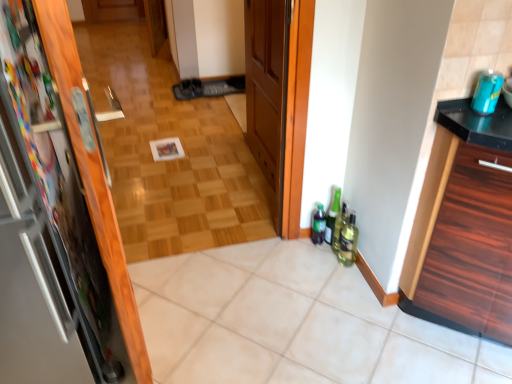
What do you see at coordinates (267, 90) in the screenshot? This screenshot has height=384, width=512. I see `wooden door at center, which is the first door from back to front` at bounding box center [267, 90].

Measure the distance between point (317, 205) and camera.

Point (317, 205) is 6.75 feet away from camera.

What do you see at coordinates (71, 178) in the screenshot? I see `metallic refrigerator at left, the 2th door viewed from the back` at bounding box center [71, 178].

Where is `metallic refrigerator at left, the 2th door viewed from the back`? metallic refrigerator at left, the 2th door viewed from the back is located at coordinates (71, 178).

Locate an element on the screen. The image size is (512, 384). black wood cabinet at right is located at coordinates (468, 223).

Which is in front, point (468, 246) or point (125, 121)?

The point (468, 246) is more forward.

You are a GUI agent. You are given a task and a screenshot of the screen. Output one action in this format:
    pyautogui.click(x=<x>, y=<y>)
    Task: Click on the corridor above the black wood cabinet at right (from a real-world perspective)
    Image resolution: width=512 pixels, height=384 pixels.
    Given the screenshot: What is the action you would take?
    pyautogui.click(x=170, y=161)

Which object is wider, black wood cabinet at right or wooden parquet floor at center?

black wood cabinet at right.

Is green glass bottle at lower right, positioned as the 2th bottle in left-to-right order, oriented away from green glass bottle at lower right, positioned as the 3th bottle in left-to-right order?

Correct, green glass bottle at lower right, positioned as the 2th bottle in left-to-right order, is looking away from green glass bottle at lower right, positioned as the 3th bottle in left-to-right order.

Is green glass bottle at lower right, which is counted as the second bottle, starting from the right, with green glass bottle at lower right, positioned as the 3th bottle in left-to-right order?

Yes, green glass bottle at lower right, which is counted as the second bottle, starting from the right, is right next to green glass bottle at lower right, positioned as the 3th bottle in left-to-right order, and making contact.

From the image's perspective, between green glass bottle at lower right, positioned as the 2th bottle in left-to-right order, and green glass bottle at lower right, which is the 1th bottle in right-to-left order, which one is located above?

green glass bottle at lower right, positioned as the 2th bottle in left-to-right order, is shown above in the image.

Between green glass bottle at lower right, which is counted as the second bottle, starting from the right, and green glass bottle at lower right, which is the 1th bottle in right-to-left order, which one has less height?

Standing shorter between the two is green glass bottle at lower right, which is the 1th bottle in right-to-left order.

Can you tell me how much green matte bottle at lower right, which appears as the 3th bottle when viewed from the right, and metallic refrigerator at left, the 2th door viewed from the back, differ in facing direction?

3.97 degrees.

Is green matte bottle at lower right, which is counted as the first bottle, starting from the left, inside or outside of metallic refrigerator at left, which is the first door from left to right?

green matte bottle at lower right, which is counted as the first bottle, starting from the left, lies outside metallic refrigerator at left, which is the first door from left to right.

Considering the sizes of objects green matte bottle at lower right, which is counted as the first bottle, starting from the left, and metallic refrigerator at left, which appears as the second door when viewed from the right, in the image provided, who is bigger, green matte bottle at lower right, which is counted as the first bottle, starting from the left, or metallic refrigerator at left, which appears as the second door when viewed from the right,?

metallic refrigerator at left, which appears as the second door when viewed from the right.

Which is more distant, (325, 223) or (113, 249)?

Point (325, 223)

What's the angular difference between metallic refrigerator at left, the 2th door viewed from the back, and white tile at center's facing directions?

metallic refrigerator at left, the 2th door viewed from the back, and white tile at center are facing 176 degrees away from each other.

Is point (48, 74) positioned in front of point (350, 284)?

Yes.

Is metallic refrigerator at left, the 2th door viewed from the back, wider than white tile at center?

Incorrect, the width of metallic refrigerator at left, the 2th door viewed from the back, does not surpass that of white tile at center.

How distant is metallic refrigerator at left, which appears as the second door when viewed from the right, from white tile at center?

They are 25.44 inches apart.

Considering the points (336, 240) and (280, 185), which point is behind, point (336, 240) or point (280, 185)?

The point (336, 240) is more distant.

Locate an element on the screen. the 1st bottle positioned below the wooden door at center, which ranks as the 2th door in front-to-back order (from a real-world perspective) is located at coordinates (339, 227).

How many degrees apart are the facing directions of green glass bottle at lower right, positioned as the 3th bottle in left-to-right order, and wooden door at center, which ranks as the 2th door in front-to-back order?

There is a 90.9-degree angle between the facing directions of green glass bottle at lower right, positioned as the 3th bottle in left-to-right order, and wooden door at center, which ranks as the 2th door in front-to-back order.

Which is more to the left, green glass bottle at lower right, positioned as the 3th bottle in left-to-right order, or wooden door at center, which is the 2th door in left-to-right order?

From the viewer's perspective, wooden door at center, which is the 2th door in left-to-right order, appears more on the left side.

How different are the orientations of wooden door at center, which is the first door from back to front, and metallic refrigerator at left, which is the first door from left to right, in degrees?

The angular difference between wooden door at center, which is the first door from back to front, and metallic refrigerator at left, which is the first door from left to right, is 86.9 degrees.

Is point (248, 68) positioned before point (49, 54)?

No, (248, 68) is behind (49, 54).

Considering the relative sizes of wooden door at center, which appears as the first door when viewed from the right, and metallic refrigerator at left, which is the first door from left to right, in the image provided, is wooden door at center, which appears as the first door when viewed from the right, smaller than metallic refrigerator at left, which is the first door from left to right,?

Correct, wooden door at center, which appears as the first door when viewed from the right, occupies less space than metallic refrigerator at left, which is the first door from left to right.

Where is `door above the metallic refrigerator at left, the 2th door viewed from the back (from the image's perspective)`? door above the metallic refrigerator at left, the 2th door viewed from the back (from the image's perspective) is located at coordinates (267, 90).

In the image, is wooden door at center, which ranks as the 2th door in front-to-back order, on the left side or the right side of green matte bottle at lower right, which is counted as the first bottle, starting from the left?

Based on their positions, wooden door at center, which ranks as the 2th door in front-to-back order, is located to the left of green matte bottle at lower right, which is counted as the first bottle, starting from the left.

Consider the image. Between wooden door at center, which is the first door from back to front, and green matte bottle at lower right, which is counted as the first bottle, starting from the left, which one has less height?

green matte bottle at lower right, which is counted as the first bottle, starting from the left.

Considering the sizes of wooden door at center, which is the 2th door in left-to-right order, and green matte bottle at lower right, which appears as the 3th bottle when viewed from the right, in the image, is wooden door at center, which is the 2th door in left-to-right order, bigger or smaller than green matte bottle at lower right, which appears as the 3th bottle when viewed from the right,?

Clearly, wooden door at center, which is the 2th door in left-to-right order, is larger in size than green matte bottle at lower right, which appears as the 3th bottle when viewed from the right.

Does wooden door at center, which is the 2th door in left-to-right order, turn towards green matte bottle at lower right, which appears as the 3th bottle when viewed from the right?

No, wooden door at center, which is the 2th door in left-to-right order, is not aimed at green matte bottle at lower right, which appears as the 3th bottle when viewed from the right.

In order to click on cabinetry that is on the right side of wooden parquet floor at center in this screenshot , I will do `click(468, 223)`.

This screenshot has height=384, width=512. Identify the location of bottle lying in front of the green glass bottle at lower right, positioned as the 2th bottle in left-to-right order. (339, 227).

Which object lies further to the anchor point teal matte can at upper right, the second beverage when ordered from back to front, metallic refrigerator at left, the 1th door in the front-to-back sequence, or green matte bottle at lower right, which is counted as the first bottle, starting from the left?

The object further to teal matte can at upper right, the second beverage when ordered from back to front, is metallic refrigerator at left, the 1th door in the front-to-back sequence.

When comparing their distances from wooden parquet floor at center, does green glass bottle at lower right, positioned as the 3th bottle in left-to-right order, or teal matte can at upper right, acting as the first beverage starting from the top, seem closer?

Among the two, green glass bottle at lower right, positioned as the 3th bottle in left-to-right order, is located nearer to wooden parquet floor at center.

Based on their spatial positions, is white tile at center or black wood cabinet at right closer to green glass bottle at lower right, which appears as the 2th beverage when viewed from the front?

Among the two, white tile at center is located nearer to green glass bottle at lower right, which appears as the 2th beverage when viewed from the front.

When comparing their distances from green glass bottle at lower right, positioned as the 3th bottle in left-to-right order, does green glass bottle at lower right, which is counted as the 2th beverage, starting from the right, or black wood cabinet at right seem further?

The object further to green glass bottle at lower right, positioned as the 3th bottle in left-to-right order, is black wood cabinet at right.

When comparing their distances from teal matte can at upper right, the first beverage in the front-to-back sequence, does green matte bottle at lower right, which is counted as the first bottle, starting from the left, or green glass bottle at lower right, positioned as the 3th bottle in left-to-right order, seem closer?

Based on the image, green glass bottle at lower right, positioned as the 3th bottle in left-to-right order, appears to be nearer to teal matte can at upper right, the first beverage in the front-to-back sequence.

From the image, which object appears to be nearer to white tile at center, green matte bottle at lower right, which is counted as the first bottle, starting from the left, or teal matte can at upper right, acting as the first beverage starting from the top?

green matte bottle at lower right, which is counted as the first bottle, starting from the left.

Which object lies nearer to the anchor point green glass bottle at lower right, which is counted as the second bottle, starting from the right, green glass bottle at lower right, positioned as the 3th bottle in left-to-right order, or teal matte can at upper right, the first beverage in the front-to-back sequence?

green glass bottle at lower right, positioned as the 3th bottle in left-to-right order, is closer to green glass bottle at lower right, which is counted as the second bottle, starting from the right.

From the image, which object appears to be nearer to white tile at center, green matte bottle at lower right, which is counted as the first bottle, starting from the left, or green glass bottle at lower right, positioned as the 3th bottle in left-to-right order?

green glass bottle at lower right, positioned as the 3th bottle in left-to-right order, is closer to white tile at center.

This screenshot has height=384, width=512. Identify the location of corridor between metallic refrigerator at left, the 1th door in the front-to-back sequence, and green glass bottle at lower right, which is the 1th bottle in right-to-left order, from front to back. (170, 161).

Locate an element on the screen. The width and height of the screenshot is (512, 384). beverage located between black wood cabinet at right and green glass bottle at lower right, which appears as the 2th beverage when viewed from the front, in the depth direction is located at coordinates (487, 92).

Where is `corridor between wooden door at center, which ranks as the 2th door in front-to-back order, and green glass bottle at lower right, which is the 1th bottle in right-to-left order, vertically`? The height and width of the screenshot is (384, 512). corridor between wooden door at center, which ranks as the 2th door in front-to-back order, and green glass bottle at lower right, which is the 1th bottle in right-to-left order, vertically is located at coordinates (170, 161).

This screenshot has width=512, height=384. Find the location of `tile between wooden parquet floor at center and black wood cabinet at right`. tile between wooden parquet floor at center and black wood cabinet at right is located at coordinates (292, 323).